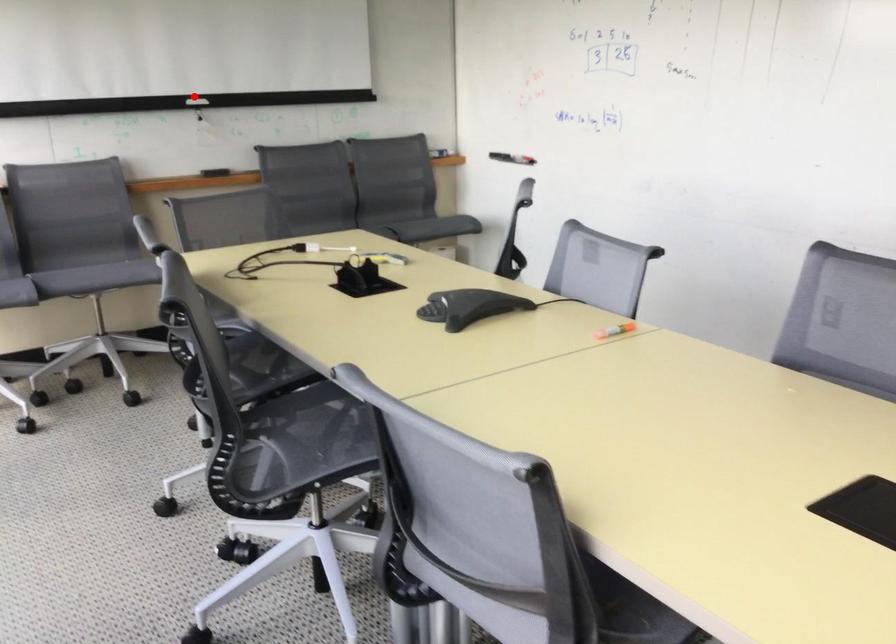
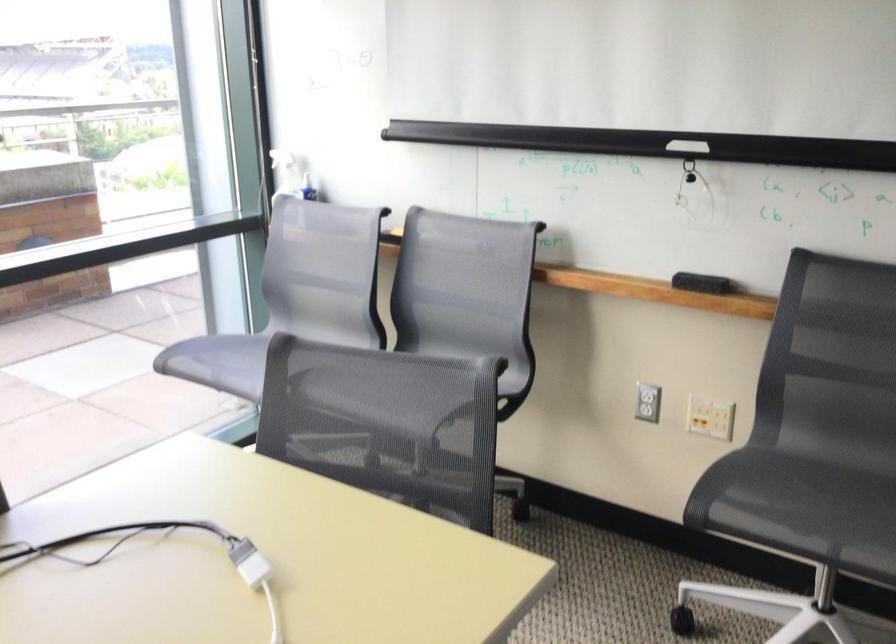
Where in the second image is the point corresponding to the highlighted location from the first image?

(687, 146)